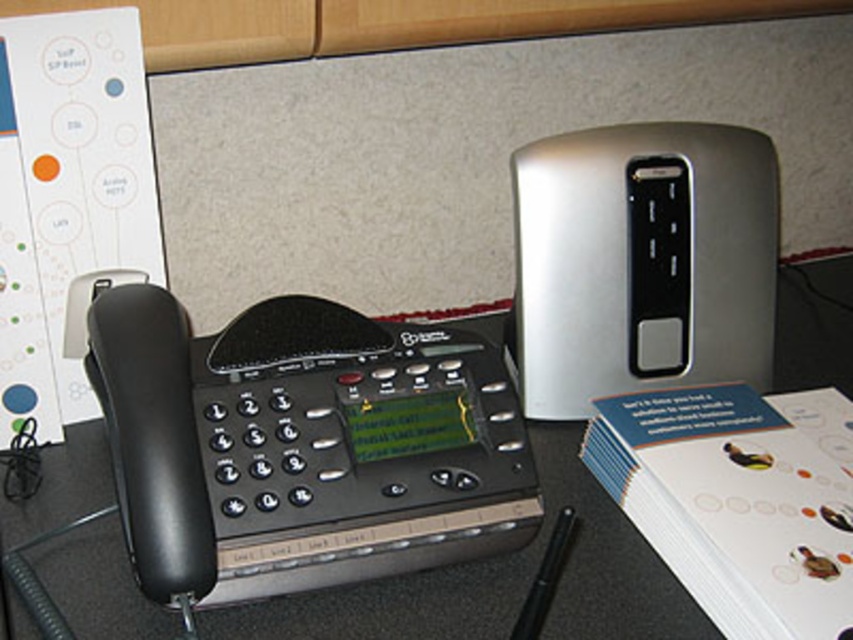
Question: Which point is farther to the camera?

Choices:
 (A) (520, 237)
 (B) (827, 304)

Answer: (B)

Question: Is silver metallic speaker at upper right further to the viewer compared to black plastic phone at left?

Choices:
 (A) no
 (B) yes

Answer: (A)

Question: Where is silver metallic speaker at upper right located in relation to black plastic phone at left in the image?

Choices:
 (A) below
 (B) above

Answer: (B)

Question: Which of the following is the closest to the observer?

Choices:
 (A) (836, 333)
 (B) (521, 244)

Answer: (B)

Question: Does silver metallic speaker at upper right have a greater width compared to black plastic phone at left?

Choices:
 (A) no
 (B) yes

Answer: (B)

Question: Which point is farther from the camera taking this photo?

Choices:
 (A) (518, 205)
 (B) (822, 308)

Answer: (B)